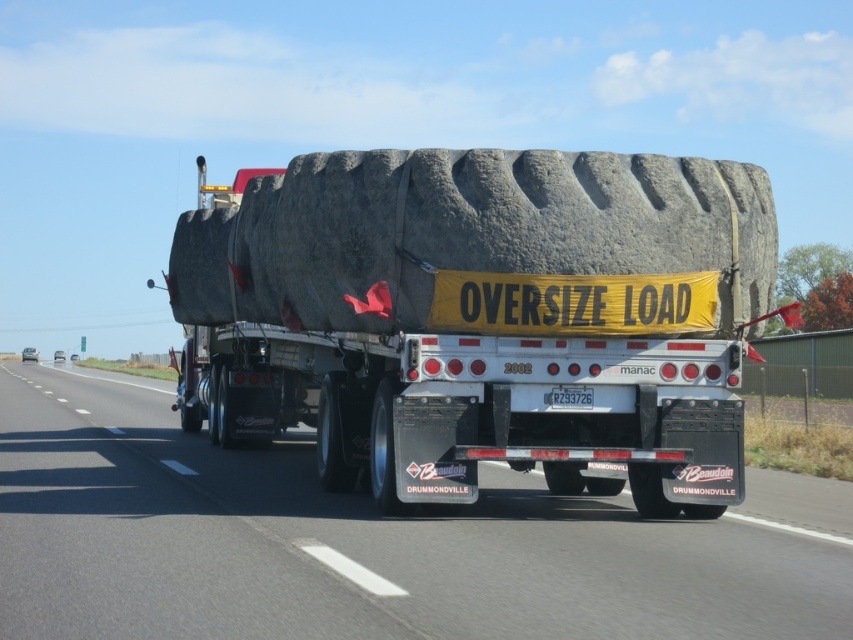
From the picture: You are a truck driver who needs to navigate a narrow bridge that is 3 meters wide. The bridge has a weight limit of 10 tons. The cargo on your truck is secured at point [485,317]. Can you safely cross the bridge with the cargo?

The point [485,317] indicates the rubber tire at center. However, the provided information does not mention the weight of the cargo or its width. Without knowing the cargo dimensions and weight, it is impossible to determine if it can safely cross the bridge within the 3 meters width and 10 tons weight limit.